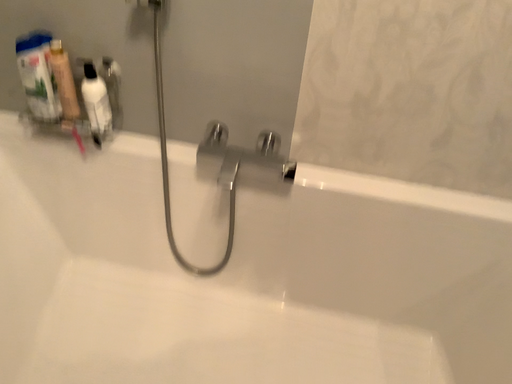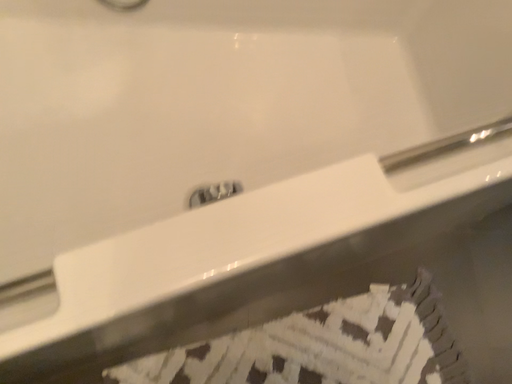
Question: Which way did the camera rotate in the video?

Choices:
 (A) rotated left
 (B) rotated right

Answer: (B)